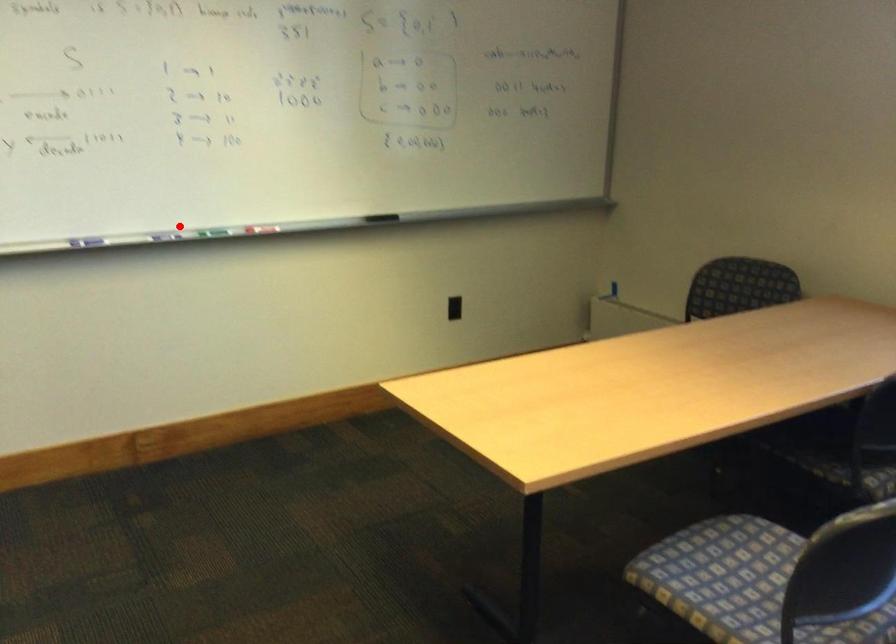
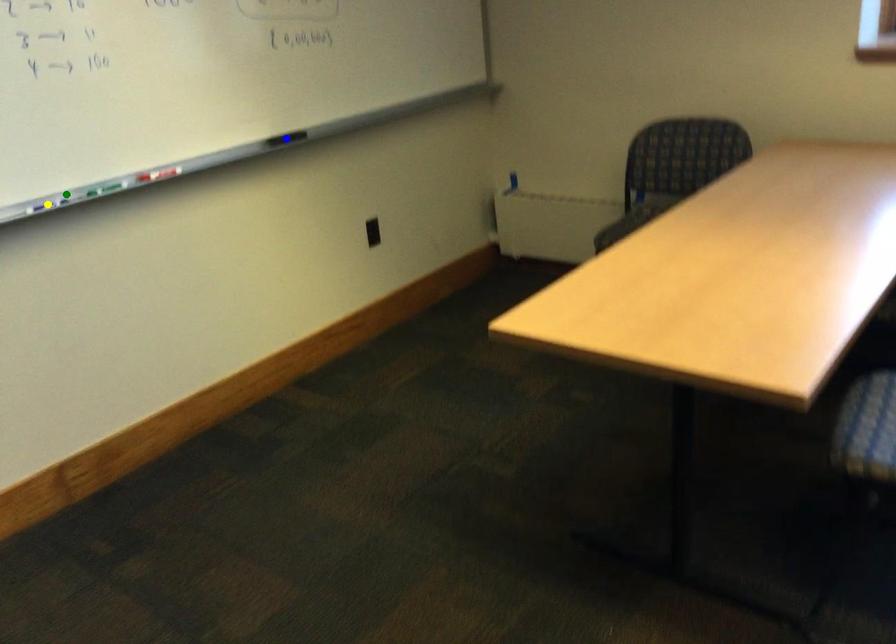
Question: I am providing you with two images of the same scene from different viewpoints. A red point is marked on the first image. You are given multiple points on the second image. Which point in image 2 is actually the same real-world point as the red point in image 1?

Choices:
 (A) blue point
 (B) green point
 (C) yellow point

Answer: (B)